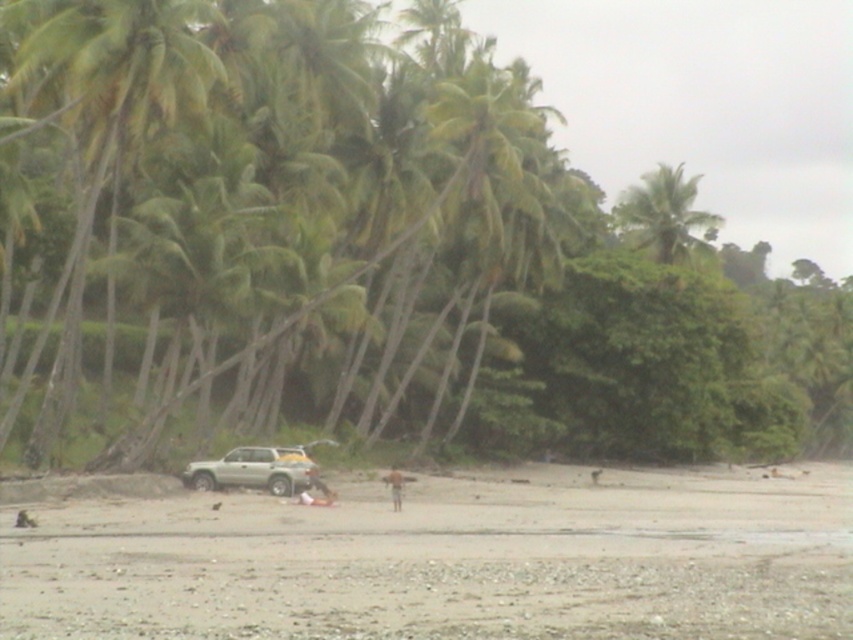
You are a photographer trying to capture the entire scene of the smooth beige sand at center and the light brown skin at center in one shot. Based on their sizes, will you need to zoom out to ensure both fit in the frame?

The smooth beige sand at center might be wider than light brown skin at center, so zooming out may be necessary to ensure both fit in the frame.